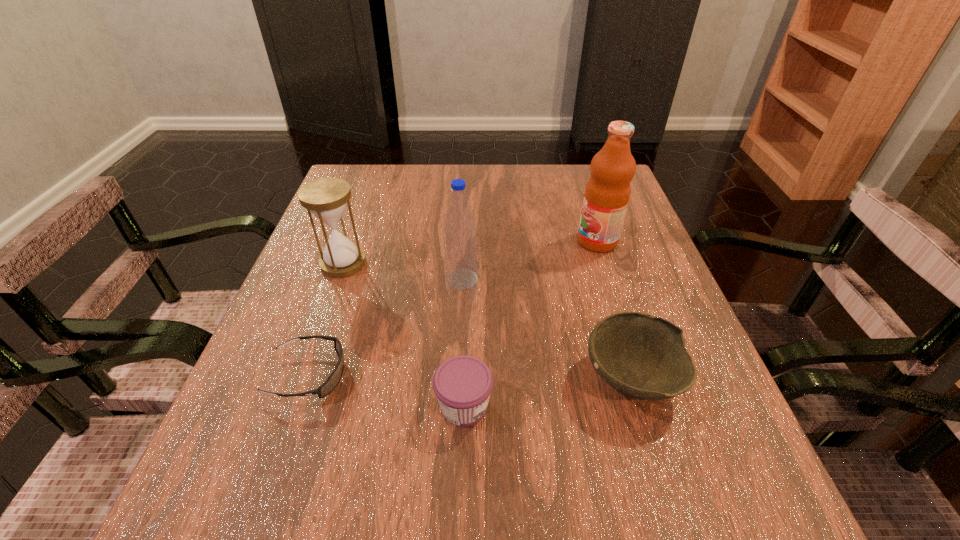
Locate an element on the screen. The image size is (960, 540). vacant area between the second tallest object and the jam is located at coordinates (463, 342).

Identify the location of unoccupied position between the water bottle and the shortest object. [x=385, y=327].

The width and height of the screenshot is (960, 540). I want to click on free space between the jam and the water bottle, so click(x=463, y=342).

Identify the location of vacant region between the water bottle and the jam. pyautogui.click(x=463, y=342).

At what (x,y) coordinates should I click in order to perform the action: click on object that is the fourth closest to the hourglass. Please return your answer as a coordinate pair (x, y). Image resolution: width=960 pixels, height=540 pixels. Looking at the image, I should click on click(x=643, y=357).

At what (x,y) coordinates should I click in order to perform the action: click on object that stands as the fourth closest to the fruit juice. Please return your answer as a coordinate pair (x, y). Looking at the image, I should click on (326, 198).

Locate an element on the screen. vacant point that satisfies the following two spatial constraints: 1. on the lenses of the goggles; 2. on the left side of the bowl is located at coordinates (307, 379).